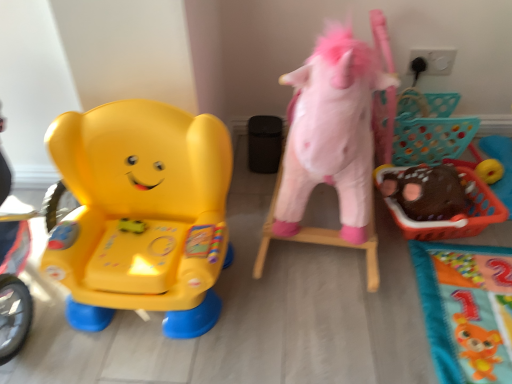
Question: Is matte plastic elephant at left, the first toy viewed from the left, at the back of fluffy pink unicorn at right, which is the 2th toy from left to right?

Choices:
 (A) yes
 (B) no

Answer: (B)

Question: Can you confirm if fluffy pink unicorn at right, arranged as the 2th toy when viewed from the right, is taller than matte plastic elephant at left, which appears as the third toy when viewed from the right?

Choices:
 (A) no
 (B) yes

Answer: (B)

Question: From a real-world perspective, is fluffy pink unicorn at right, arranged as the 2th toy when viewed from the right, positioned under matte plastic elephant at left, which appears as the third toy when viewed from the right, based on gravity?

Choices:
 (A) yes
 (B) no

Answer: (B)

Question: Is matte plastic elephant at left, the first toy viewed from the left, completely or partially inside fluffy pink unicorn at right, arranged as the 2th toy when viewed from the right?

Choices:
 (A) no
 (B) yes

Answer: (A)

Question: From a real-world perspective, is fluffy pink unicorn at right, which is the 2th toy from left to right, over matte plastic elephant at left, which appears as the third toy when viewed from the right?

Choices:
 (A) yes
 (B) no

Answer: (A)

Question: Considering the positions of point (377, 274) and point (409, 96), is point (377, 274) closer or farther from the camera than point (409, 96)?

Choices:
 (A) closer
 (B) farther

Answer: (A)

Question: Visually, is fluffy pink unicorn at right, which is the 2th toy from left to right, positioned to the left or to the right of brown fuzzy plush at right, which appears as the first toy when viewed from the right?

Choices:
 (A) left
 (B) right

Answer: (A)

Question: Relative to brown fuzzy plush at right, which appears as the first toy when viewed from the right, is fluffy pink unicorn at right, arranged as the 2th toy when viewed from the right, in front or behind?

Choices:
 (A) behind
 (B) front

Answer: (B)

Question: From the image's perspective, is fluffy pink unicorn at right, arranged as the 2th toy when viewed from the right, positioned above or below brown fuzzy plush at right, which appears as the 3th toy when viewed from the left?

Choices:
 (A) above
 (B) below

Answer: (A)

Question: Considering the positions of matte plastic elephant at left, which appears as the third toy when viewed from the right, and brown fuzzy plush at right, which appears as the 3th toy when viewed from the left, in the image, is matte plastic elephant at left, which appears as the third toy when viewed from the right, bigger or smaller than brown fuzzy plush at right, which appears as the 3th toy when viewed from the left,?

Choices:
 (A) small
 (B) big

Answer: (B)

Question: In the image, is matte plastic elephant at left, which appears as the third toy when viewed from the right, positioned in front of or behind brown fuzzy plush at right, which appears as the 3th toy when viewed from the left?

Choices:
 (A) front
 (B) behind

Answer: (A)

Question: Is point (53, 266) positioned closer to the camera than point (435, 231)?

Choices:
 (A) closer
 (B) farther

Answer: (A)

Question: Do you think matte plastic elephant at left, which appears as the third toy when viewed from the right, is within brown fuzzy plush at right, which appears as the first toy when viewed from the right, or outside of it?

Choices:
 (A) outside
 (B) inside

Answer: (A)

Question: Considering the positions of point (94, 172) and point (348, 64), is point (94, 172) closer or farther from the camera than point (348, 64)?

Choices:
 (A) closer
 (B) farther

Answer: (B)

Question: Considering the positions of matte plastic elephant at left, which appears as the third toy when viewed from the right, and fluffy pink unicorn at right, which is the 2th toy from left to right, in the image, is matte plastic elephant at left, which appears as the third toy when viewed from the right, taller or shorter than fluffy pink unicorn at right, which is the 2th toy from left to right,?

Choices:
 (A) tall
 (B) short

Answer: (B)